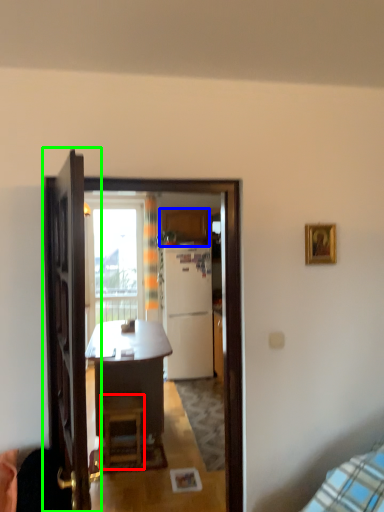
Question: Considering the real-world distances, which object is closest to stool (highlighted by a red box)? cabinetry (highlighted by a blue box) or door (highlighted by a green box).

Choices:
 (A) cabinetry
 (B) door

Answer: (B)